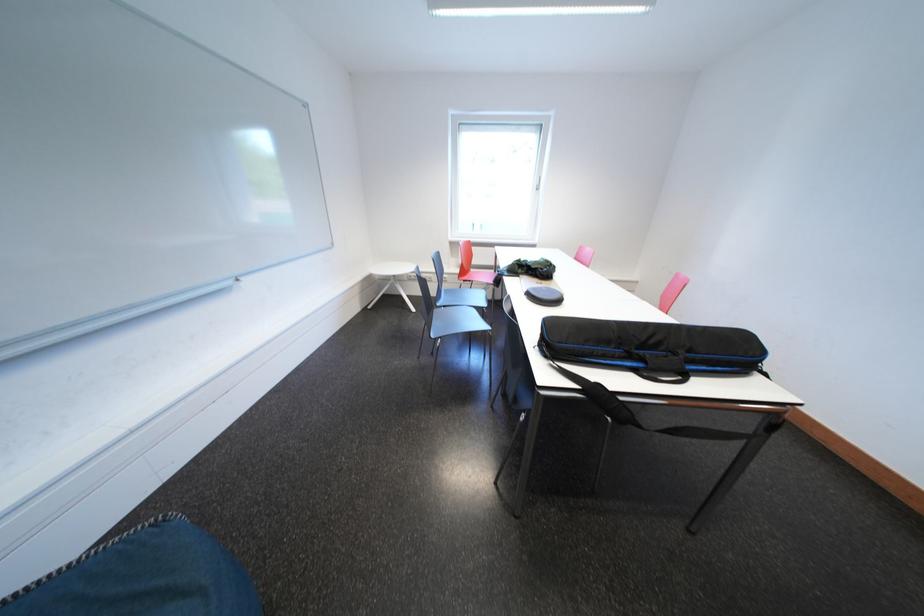
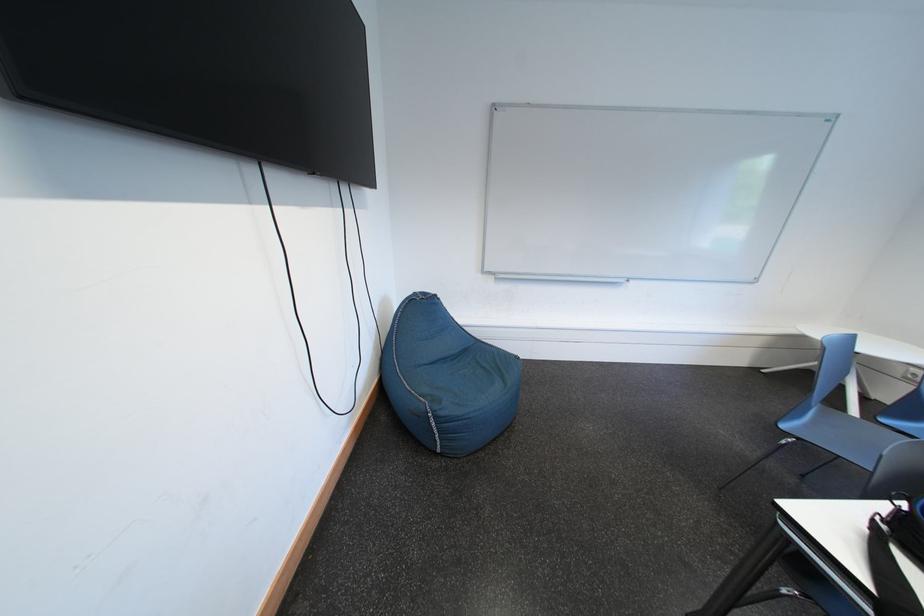
How did the camera likely rotate?

The rotation direction of the camera is left-down.